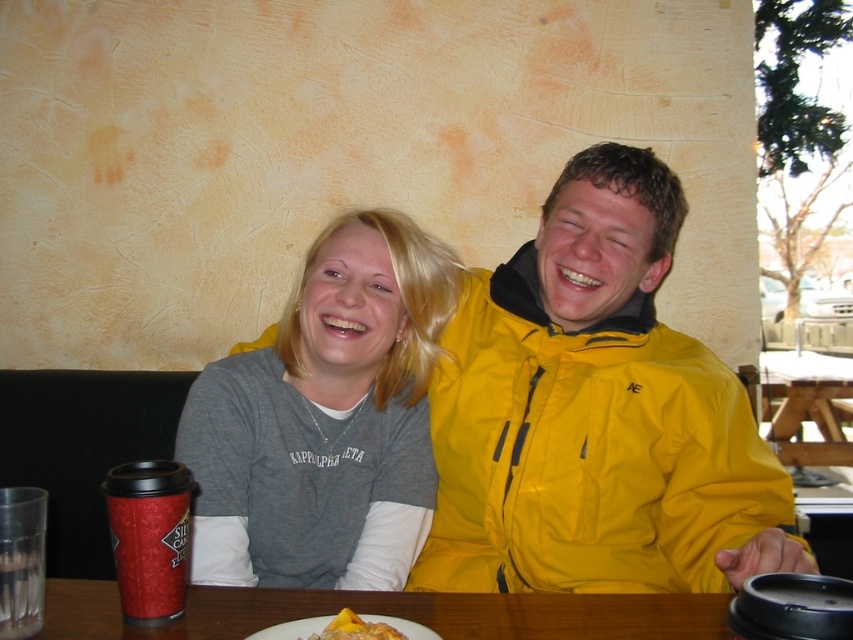
At what (x,y) coordinates should I click in order to perform the action: click on yellow waterproof jacket at right. Please return your answer as a coordinate pair (x, y). The width and height of the screenshot is (853, 640). Looking at the image, I should click on (585, 451).

Between point (503, 282) and point (397, 634), which one is positioned behind?

Positioned behind is point (503, 282).

Does point (567, 561) come farther from viewer compared to point (347, 621)?

Yes.

This screenshot has width=853, height=640. What are the coordinates of `yellow waterproof jacket at right` in the screenshot? It's located at (585, 451).

Is point (524, 612) farther from viewer compared to point (322, 634)?

Yes, it is behind point (322, 634).

Image resolution: width=853 pixels, height=640 pixels. What do you see at coordinates (390, 612) in the screenshot?
I see `brown wooden table at center` at bounding box center [390, 612].

Between point (173, 634) and point (358, 637), which one is positioned in front?

Positioned in front is point (358, 637).

This screenshot has height=640, width=853. In order to click on brown wooden table at center in this screenshot , I will do `click(390, 612)`.

How far apart are yellow waterproof jacket at right and brown wooden table at center?

The distance of yellow waterproof jacket at right from brown wooden table at center is 15.94 inches.

Is yellow waterproof jacket at right in front of brown wooden table at center?

No, yellow waterproof jacket at right is behind brown wooden table at center.

Is point (473, 333) farther from camera compared to point (85, 611)?

Yes, point (473, 333) is behind point (85, 611).

I want to click on yellow waterproof jacket at right, so click(585, 451).